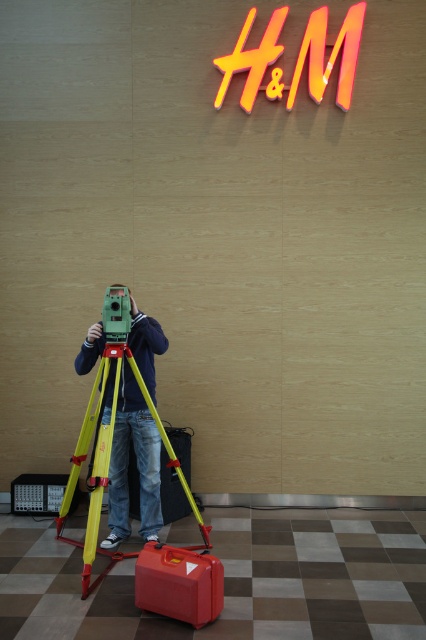
Question: Does green matte tripod at center appear on the left side of matte red suitcase at lower center?

Choices:
 (A) no
 (B) yes

Answer: (B)

Question: Which object is positioned closest to the yellow plastic tripod at center?

Choices:
 (A) red plastic suitcase at center
 (B) green matte tripod at center
 (C) matte red suitcase at lower center

Answer: (B)

Question: Is green matte tripod at center positioned in front of orange neon sign at upper center?

Choices:
 (A) yes
 (B) no

Answer: (A)

Question: Which point appears closest to the camera in this image?

Choices:
 (A) (143, 554)
 (B) (86, 435)
 (C) (123, 392)

Answer: (A)

Question: Among these points, which one is nearest to the camera?

Choices:
 (A) (x=155, y=550)
 (B) (x=149, y=529)
 (C) (x=160, y=492)
 (D) (x=101, y=486)

Answer: (A)

Question: Considering the relative positions of orange neon sign at upper center and matte red suitcase at lower center in the image provided, where is orange neon sign at upper center located with respect to matte red suitcase at lower center?

Choices:
 (A) left
 (B) right

Answer: (B)